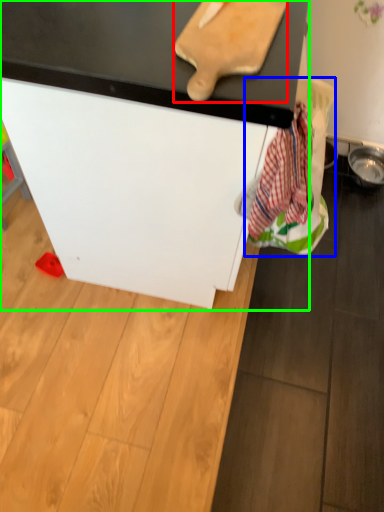
Question: Which is farther away from cutting board (highlighted by a red box)? laundry (highlighted by a blue box) or furniture (highlighted by a green box)?

Choices:
 (A) laundry
 (B) furniture

Answer: (A)